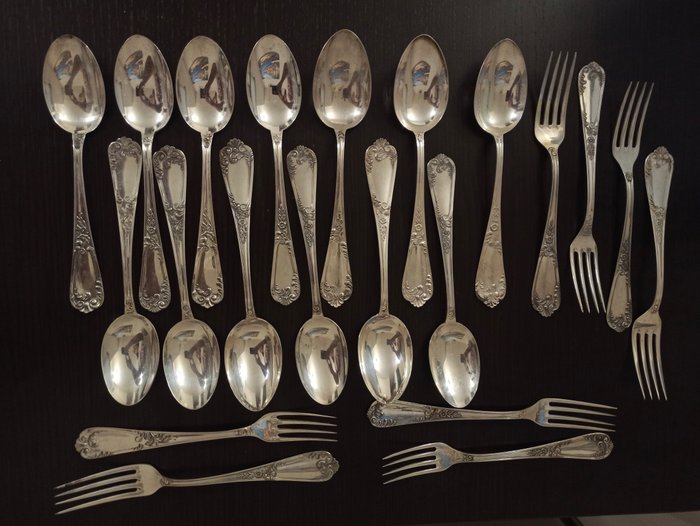
You are a GUI agent. You are given a task and a screenshot of the screen. Output one action in this format:
    pyautogui.click(x=<x>, y=<y>)
    Task: Click on the fork
    Image resolution: width=700 pixels, height=526 pixels.
    Given the screenshot: What is the action you would take?
    pyautogui.click(x=553, y=128), pyautogui.click(x=589, y=104), pyautogui.click(x=626, y=160), pyautogui.click(x=665, y=183), pyautogui.click(x=542, y=414), pyautogui.click(x=582, y=449), pyautogui.click(x=312, y=472), pyautogui.click(x=124, y=441)